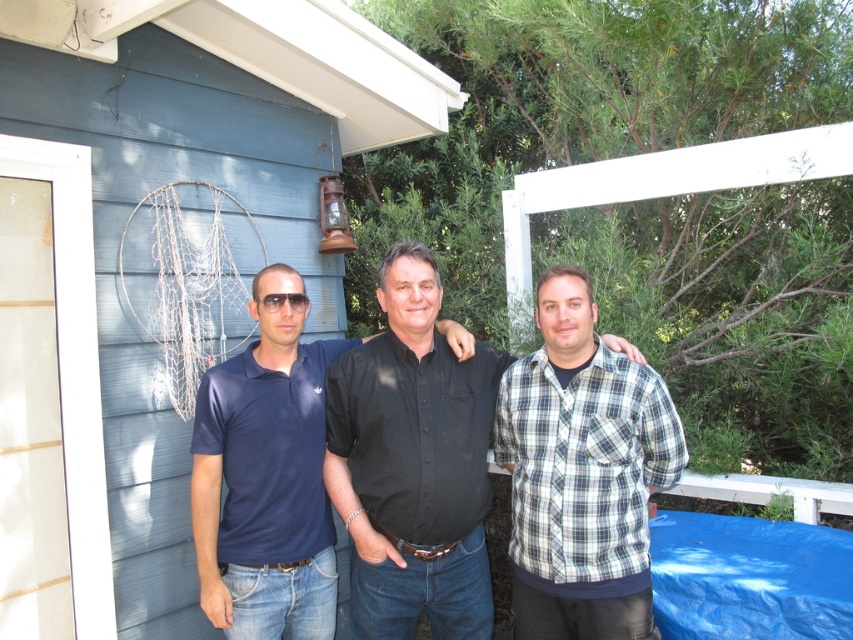
Who is more forward, (354, 424) or (219, 596)?

Point (219, 596) is in front.

Does black matte shirt at center appear under dark blue cotton polo shirt at center?

No, black matte shirt at center is not below dark blue cotton polo shirt at center.

What do you see at coordinates (412, 461) in the screenshot?
I see `black matte shirt at center` at bounding box center [412, 461].

The height and width of the screenshot is (640, 853). Find the location of `black matte shirt at center`. black matte shirt at center is located at coordinates (412, 461).

Is point (587, 404) in front of point (280, 296)?

Yes, it is in front of point (280, 296).

Describe the element at coordinates (582, 472) in the screenshot. This screenshot has width=853, height=640. I see `plaid cotton shirt at center` at that location.

Who is more forward, (575,422) or (270,316)?

Point (575,422) is more forward.

What are the coordinates of `plaid cotton shirt at center` in the screenshot? It's located at (582, 472).

Can you confirm if black matte shirt at center is wider than plaid cotton shirt at center?

Yes, black matte shirt at center is wider than plaid cotton shirt at center.

Can you confirm if black matte shirt at center is thinner than plaid cotton shirt at center?

Incorrect, black matte shirt at center's width is not less than plaid cotton shirt at center's.

Is point (352, 532) positioned in front of point (532, 568)?

No, it is not.

This screenshot has height=640, width=853. Find the location of `black matte shirt at center`. black matte shirt at center is located at coordinates (412, 461).